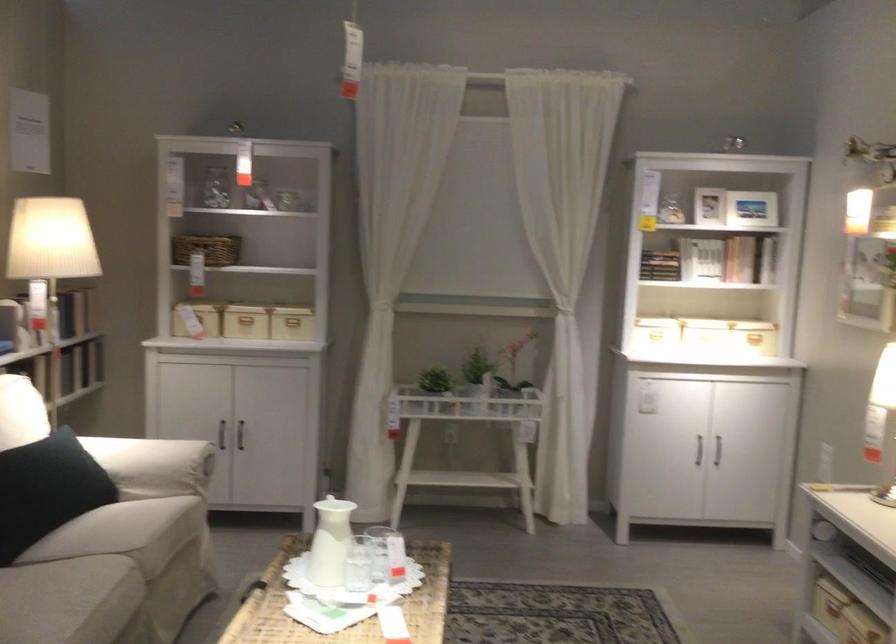
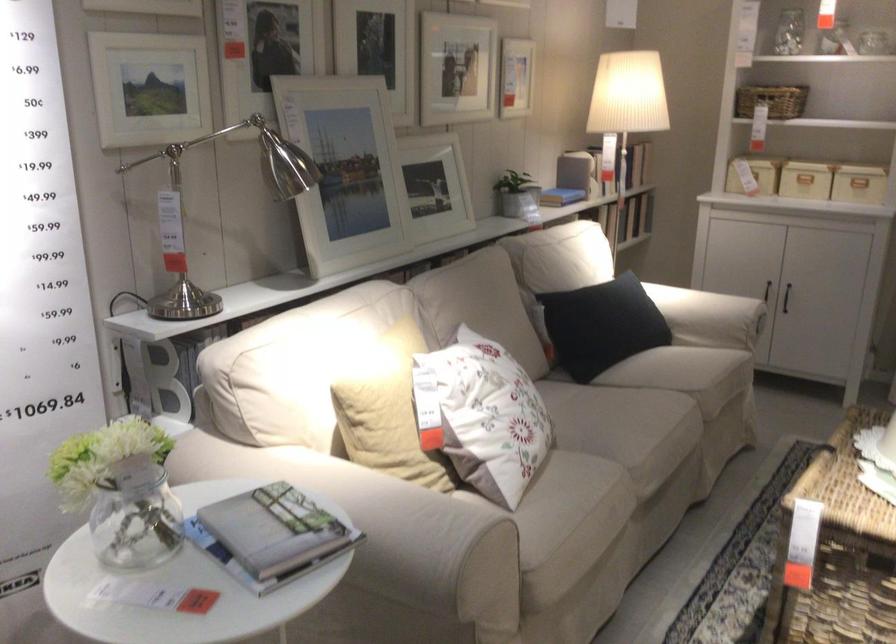
The point at (152, 478) is marked in the first image. Where is the corresponding point in the second image?

(709, 317)